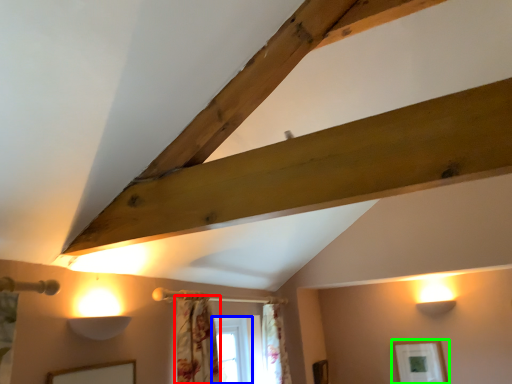
Question: Which is farther away from curtain (highlighted by a red box)? window (highlighted by a blue box) or picture frame (highlighted by a green box)?

Choices:
 (A) window
 (B) picture frame

Answer: (B)